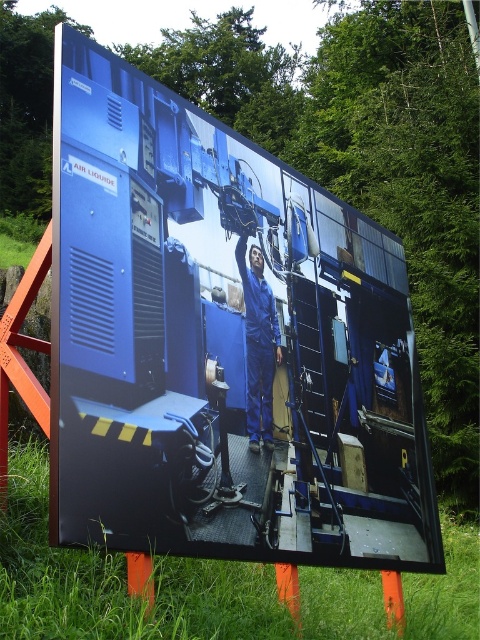
Question: Is green grass at lower left to the right of blue smooth jumpsuit at center from the viewer's perspective?

Choices:
 (A) no
 (B) yes

Answer: (B)

Question: Can you confirm if blue metallic machinery at center is thinner than blue smooth jumpsuit at center?

Choices:
 (A) yes
 (B) no

Answer: (B)

Question: Which object is closer to the camera taking this photo?

Choices:
 (A) blue metallic machinery at center
 (B) green grass at lower left

Answer: (B)

Question: Can you confirm if blue metallic machinery at center is positioned to the right of green grass at lower left?

Choices:
 (A) yes
 (B) no

Answer: (B)

Question: Which of the following is the closest to the observer?

Choices:
 (A) (334, 632)
 (B) (315, 369)
 (C) (277, 362)

Answer: (A)

Question: Which object is positioned closest to the blue smooth jumpsuit at center?

Choices:
 (A) green grass at lower left
 (B) blue metallic machinery at center

Answer: (B)